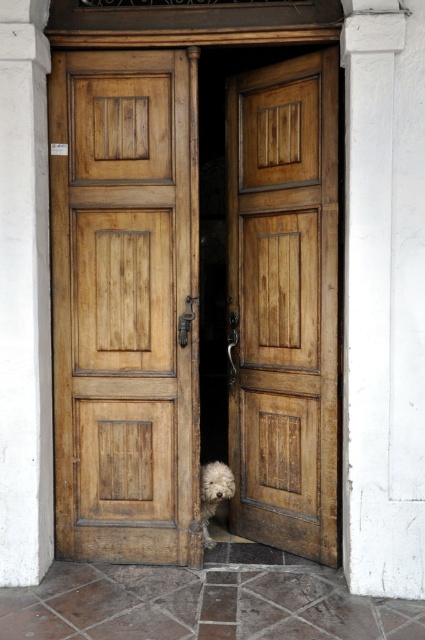
Question: Among these points, which one is farthest from the camera?

Choices:
 (A) (45, 164)
 (B) (345, 36)

Answer: (A)

Question: Which point is farther from the camera taking this photo?

Choices:
 (A) (76, 52)
 (B) (311, 140)
 (C) (397, 484)
 (D) (218, 492)

Answer: (D)

Question: Does white marble pillar at right appear over white fluffy dog at lower center?

Choices:
 (A) no
 (B) yes

Answer: (B)

Question: Does light brown wooden door at center appear on the right side of white marble pillar at right?

Choices:
 (A) no
 (B) yes

Answer: (A)

Question: Which of the following is the farthest from the observer?

Choices:
 (A) (319, 332)
 (B) (351, 257)

Answer: (A)

Question: From the image, what is the correct spatial relationship of white marble pillar at right in relation to white fluffy dog at lower center?

Choices:
 (A) above
 (B) below

Answer: (A)